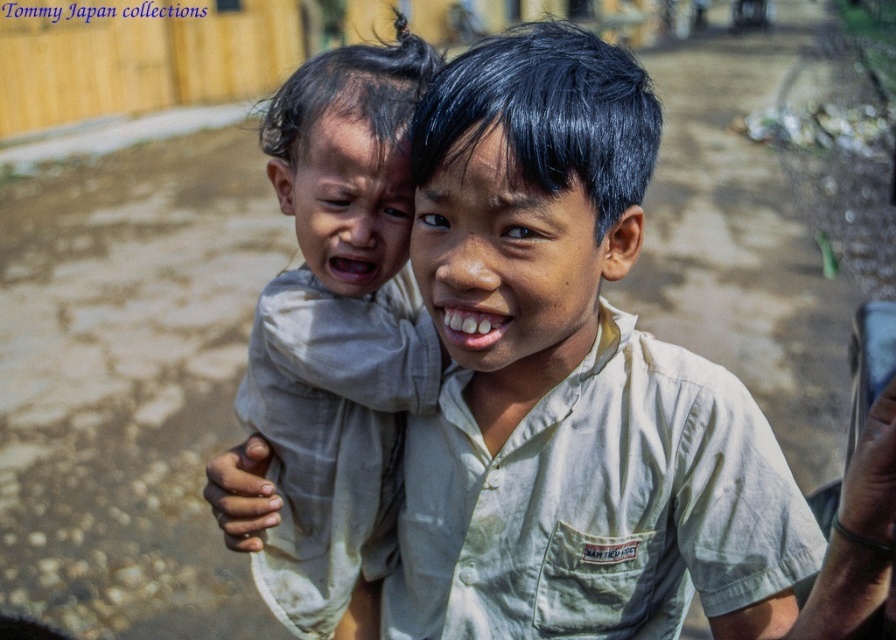
Is light beige shirt at center taller than light beige fabric baby at left?

In fact, light beige shirt at center may be shorter than light beige fabric baby at left.

Does light beige shirt at center appear on the left side of light beige fabric baby at left?

No, light beige shirt at center is not to the left of light beige fabric baby at left.

Is point (649, 413) positioned behind point (293, 106)?

No.

The image size is (896, 640). I want to click on light beige shirt at center, so click(570, 381).